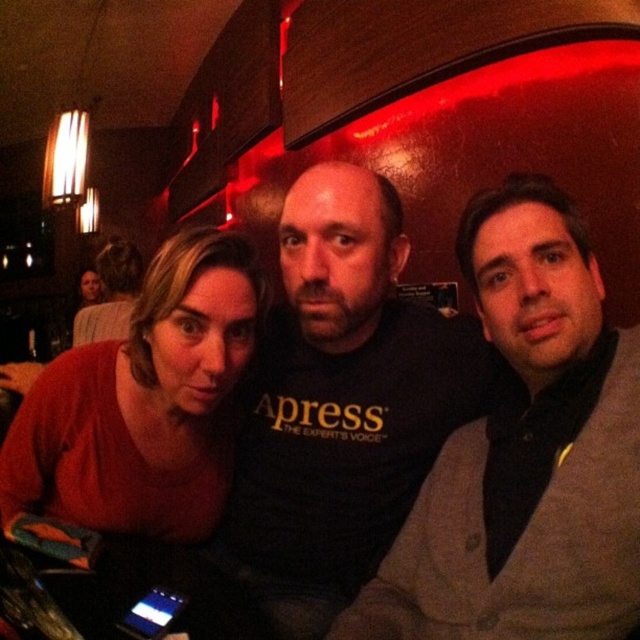
Question: Among these points, which one is nearest to the camera?

Choices:
 (A) (400, 440)
 (B) (177, 298)
 (C) (616, 360)

Answer: (C)

Question: Does gray sweater at center have a lesser width compared to black t-shirt at center?

Choices:
 (A) no
 (B) yes

Answer: (B)

Question: Is gray sweater at center further to camera compared to matte red sweater at lower left?

Choices:
 (A) yes
 (B) no

Answer: (B)

Question: Considering the real-world distances, which object is closest to the matte red sweater at lower left?

Choices:
 (A) gray sweater at center
 (B) black t-shirt at center

Answer: (B)

Question: Is black t-shirt at center to the right of matte red sweater at lower left from the viewer's perspective?

Choices:
 (A) yes
 (B) no

Answer: (A)

Question: Among these objects, which one is farthest from the camera?

Choices:
 (A) matte red sweater at lower left
 (B) gray sweater at center

Answer: (A)